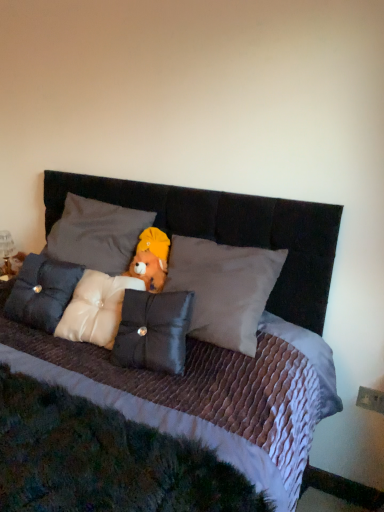
Image resolution: width=384 pixels, height=512 pixels. What do you see at coordinates (42, 292) in the screenshot?
I see `satin cushion at center, marked as the first pillow in a left-to-right arrangement` at bounding box center [42, 292].

Measure the distance between point (x=137, y=275) and camera.

Point (x=137, y=275) is 1.68 meters away from camera.

At what (x,y) coordinates should I click in order to perform the action: click on satin black pillow at center, which ranks as the first pillow in right-to-left order. Please return your answer as a coordinate pair (x, y). This screenshot has width=384, height=512. Looking at the image, I should click on (153, 331).

Locate an element on the screen. satin cushion at center, which ranks as the 4th pillow in right-to-left order is located at coordinates (42, 292).

Considering the relative sizes of satin white pillow at center, which is the second pillow in right-to-left order, and metallic gold figurine at left in the image provided, is satin white pillow at center, which is the second pillow in right-to-left order, shorter than metallic gold figurine at left?

In fact, satin white pillow at center, which is the second pillow in right-to-left order, may be taller than metallic gold figurine at left.

Could you measure the distance between satin white pillow at center, which ranks as the third pillow in left-to-right order, and metallic gold figurine at left?

29.91 inches.

Could you tell me if satin white pillow at center, which is the second pillow in right-to-left order, is facing metallic gold figurine at left?

No, satin white pillow at center, which is the second pillow in right-to-left order, is not oriented towards metallic gold figurine at left.

Can you confirm if satin white pillow at center, which is the second pillow in right-to-left order, is positioned to the left of metallic gold figurine at left?

Incorrect, satin white pillow at center, which is the second pillow in right-to-left order, is not on the left side of metallic gold figurine at left.

Is satin cushion at center, marked as the first pillow in a left-to-right arrangement, aimed at fuzzy fabric teddy bear at center?

No, satin cushion at center, marked as the first pillow in a left-to-right arrangement, is not facing towards fuzzy fabric teddy bear at center.

Based on their sizes in the image, would you say satin cushion at center, which ranks as the 4th pillow in right-to-left order, is bigger or smaller than fuzzy fabric teddy bear at center?

Clearly, satin cushion at center, which ranks as the 4th pillow in right-to-left order, is larger in size than fuzzy fabric teddy bear at center.

Are satin cushion at center, marked as the first pillow in a left-to-right arrangement, and fuzzy fabric teddy bear at center beside each other?

satin cushion at center, marked as the first pillow in a left-to-right arrangement, and fuzzy fabric teddy bear at center are not in contact.

You are a GUI agent. You are given a task and a screenshot of the screen. Output one action in this format:
    pyautogui.click(x=<x>, y=<y>)
    Task: Click on the 1st pillow in front of the fuzzy fabric teddy bear at center
    
    Given the screenshot: What is the action you would take?
    pyautogui.click(x=42, y=292)

Between point (110, 239) and point (13, 255), which one is positioned behind?

Positioned behind is point (13, 255).

Are white satin pillow at center, the 3th pillow from the right, and metallic gold figurine at left far apart?

That's not correct — white satin pillow at center, the 3th pillow from the right, is a little close to metallic gold figurine at left.

From a real-world perspective, is white satin pillow at center, placed as the second pillow when sorted from left to right, under metallic gold figurine at left?

No.

Looking at this image, between metallic gold figurine at left and white satin pillow at center, the 3th pillow from the right, which one has less height?

With less height is metallic gold figurine at left.

In order to click on the 2nd pillow counting from the right side of the metallic gold figurine at left in this screenshot , I will do `click(97, 234)`.

Is metallic gold figurine at left oriented towards white satin pillow at center, the 3th pillow from the right?

No, metallic gold figurine at left is not turned towards white satin pillow at center, the 3th pillow from the right.

Is white satin pillow at center, placed as the second pillow when sorted from left to right, not near fuzzy fabric teddy bear at center?

No, there isn't a large distance between white satin pillow at center, placed as the second pillow when sorted from left to right, and fuzzy fabric teddy bear at center.

Is white satin pillow at center, placed as the second pillow when sorted from left to right, aimed at fuzzy fabric teddy bear at center?

No.

Does white satin pillow at center, placed as the second pillow when sorted from left to right, have a greater height compared to fuzzy fabric teddy bear at center?

Indeed, white satin pillow at center, placed as the second pillow when sorted from left to right, has a greater height compared to fuzzy fabric teddy bear at center.

Which is behind, point (114, 226) or point (154, 233)?

The point (114, 226) is more distant.

Is satin black pillow at center, which ranks as the first pillow in right-to-left order, to the right of metallic gold figurine at left from the viewer's perspective?

Indeed, satin black pillow at center, which ranks as the first pillow in right-to-left order, is positioned on the right side of metallic gold figurine at left.

Which object is closer to the camera, satin black pillow at center, which ranks as the first pillow in right-to-left order, or metallic gold figurine at left?

satin black pillow at center, which ranks as the first pillow in right-to-left order, is closer to the camera.

From the picture: Could you measure the distance between satin black pillow at center, arranged as the 4th pillow when viewed from the left, and metallic gold figurine at left?

satin black pillow at center, arranged as the 4th pillow when viewed from the left, is 3.40 feet away from metallic gold figurine at left.

From the image's perspective, which is above, satin black pillow at center, which ranks as the first pillow in right-to-left order, or metallic gold figurine at left?

From the image's view, metallic gold figurine at left is above.

Considering the sizes of metallic gold figurine at left and satin white pillow at center, which ranks as the third pillow in left-to-right order, in the image, is metallic gold figurine at left taller or shorter than satin white pillow at center, which ranks as the third pillow in left-to-right order,?

metallic gold figurine at left is shorter than satin white pillow at center, which ranks as the third pillow in left-to-right order.

Are metallic gold figurine at left and satin white pillow at center, which ranks as the third pillow in left-to-right order, located far from each other?

That's not correct — metallic gold figurine at left is a little close to satin white pillow at center, which ranks as the third pillow in left-to-right order.

Considering the positions of point (8, 275) and point (88, 274), is point (8, 275) closer or farther from the camera than point (88, 274)?

Point (8, 275) appears to be farther away from the viewer than point (88, 274).

From a real-world perspective, between metallic gold figurine at left and satin white pillow at center, which ranks as the third pillow in left-to-right order, who is vertically higher?

satin white pillow at center, which ranks as the third pillow in left-to-right order, is physically above.

Image resolution: width=384 pixels, height=512 pixels. Identify the location of figurine lying above the satin white pillow at center, which ranks as the third pillow in left-to-right order (from the image's perspective). (13, 264).

From the image's perspective, which pillow is the 1st one below the fuzzy fabric teddy bear at center? Please provide its 2D coordinates.

[(42, 292)]

Based on their spatial positions, is fuzzy fabric teddy bear at center or white satin pillow at center, the 3th pillow from the right, further from satin black pillow at center, which ranks as the first pillow in right-to-left order?

The object further to satin black pillow at center, which ranks as the first pillow in right-to-left order, is white satin pillow at center, the 3th pillow from the right.

When comparing their distances from fuzzy fabric teddy bear at center, does satin black pillow at center, arranged as the 4th pillow when viewed from the left, or satin white pillow at center, which ranks as the third pillow in left-to-right order, seem closer?

Based on the image, satin white pillow at center, which ranks as the third pillow in left-to-right order, appears to be nearer to fuzzy fabric teddy bear at center.

Considering their positions, is satin white pillow at center, which is the second pillow in right-to-left order, positioned closer to satin black pillow at center, which ranks as the first pillow in right-to-left order, than fuzzy fabric teddy bear at center?

Based on the image, satin white pillow at center, which is the second pillow in right-to-left order, appears to be nearer to satin black pillow at center, which ranks as the first pillow in right-to-left order.

When comparing their distances from satin white pillow at center, which ranks as the third pillow in left-to-right order, does white satin pillow at center, the 3th pillow from the right, or fuzzy fabric teddy bear at center seem further?

Based on the image, white satin pillow at center, the 3th pillow from the right, appears to be further to satin white pillow at center, which ranks as the third pillow in left-to-right order.

Estimate the real-world distances between objects in this image. Which object is further from satin cushion at center, which ranks as the 4th pillow in right-to-left order, fuzzy fabric teddy bear at center or metallic gold figurine at left?

metallic gold figurine at left is positioned further to the anchor satin cushion at center, which ranks as the 4th pillow in right-to-left order.

Based on the photo, considering their positions, is white satin pillow at center, the 3th pillow from the right, positioned further to satin white pillow at center, which is the second pillow in right-to-left order, than satin cushion at center, which ranks as the 4th pillow in right-to-left order?

white satin pillow at center, the 3th pillow from the right, is further to satin white pillow at center, which is the second pillow in right-to-left order.

Which object lies nearer to the anchor point satin white pillow at center, which is the second pillow in right-to-left order, metallic gold figurine at left or white satin pillow at center, placed as the second pillow when sorted from left to right?

white satin pillow at center, placed as the second pillow when sorted from left to right.

From the image, which object appears to be nearer to satin cushion at center, marked as the first pillow in a left-to-right arrangement, satin black pillow at center, arranged as the 4th pillow when viewed from the left, or fuzzy fabric teddy bear at center?

fuzzy fabric teddy bear at center.

This screenshot has height=512, width=384. I want to click on toy between satin white pillow at center, which ranks as the third pillow in left-to-right order, and metallic gold figurine at left, along the z-axis, so click(150, 259).

The image size is (384, 512). Identify the location of toy located between satin black pillow at center, arranged as the 4th pillow when viewed from the left, and metallic gold figurine at left in the depth direction. (150, 259).

Where is `pillow between white satin pillow at center, the 3th pillow from the right, and satin white pillow at center, which ranks as the third pillow in left-to-right order, in the vertical direction`? pillow between white satin pillow at center, the 3th pillow from the right, and satin white pillow at center, which ranks as the third pillow in left-to-right order, in the vertical direction is located at coordinates (42, 292).

Where is `pillow between satin cushion at center, marked as the first pillow in a left-to-right arrangement, and metallic gold figurine at left in the front-back direction`? The width and height of the screenshot is (384, 512). pillow between satin cushion at center, marked as the first pillow in a left-to-right arrangement, and metallic gold figurine at left in the front-back direction is located at coordinates (97, 234).